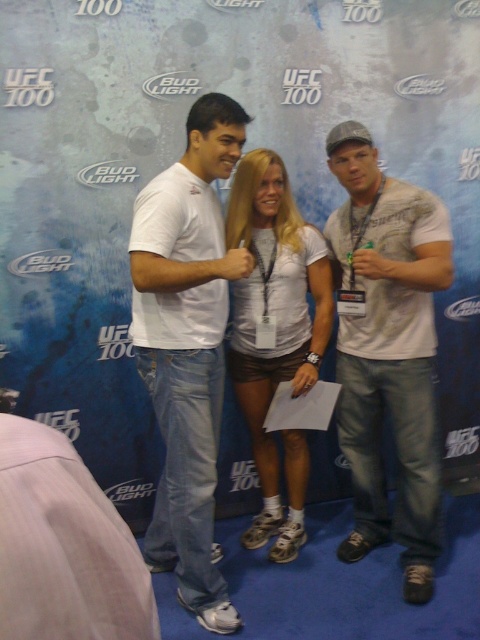
Question: Does white cotton t-shirt at center have a lesser width compared to white matte shorts at center?

Choices:
 (A) yes
 (B) no

Answer: (B)

Question: Which of the following is the closest to the observer?

Choices:
 (A) (288, 444)
 (B) (180, 548)

Answer: (B)

Question: Does white textured t-shirt at center have a larger size compared to white cotton t-shirt at center?

Choices:
 (A) no
 (B) yes

Answer: (A)

Question: Estimate the real-world distances between objects in this image. Which object is closer to the white textured t-shirt at center?

Choices:
 (A) white cotton t-shirt at center
 (B) white matte shorts at center

Answer: (B)

Question: Can you confirm if white textured t-shirt at center is positioned above white matte shorts at center?

Choices:
 (A) yes
 (B) no

Answer: (A)

Question: Among these points, which one is nearest to the camera?

Choices:
 (A) (190, 168)
 (B) (273, 227)
 (C) (336, 268)

Answer: (A)